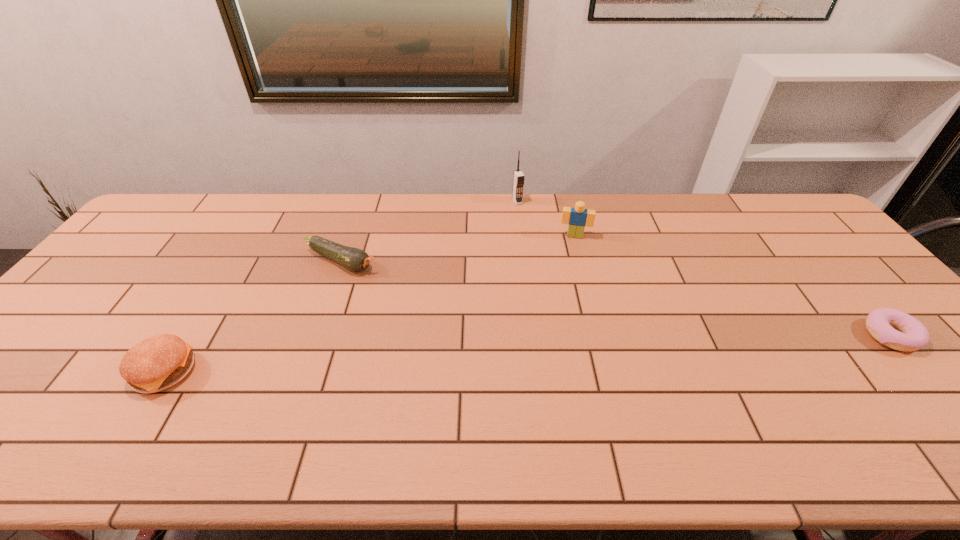
Locate an element on the screen. Image resolution: width=960 pixels, height=540 pixels. vacant space located on the face of the Lego is located at coordinates (565, 318).

This screenshot has width=960, height=540. I want to click on cellular telephone that is at the far edge, so click(x=518, y=177).

The width and height of the screenshot is (960, 540). Find the location of `Lego present at the far edge`. Lego present at the far edge is located at coordinates (579, 217).

Find the location of a particular element. The width and height of the screenshot is (960, 540). object present at the near edge is located at coordinates (159, 362).

Image resolution: width=960 pixels, height=540 pixels. Identify the location of object positioned at the right edge. (912, 335).

The image size is (960, 540). In the image, there is a desktop. What are the coordinates of `vacant region at the far edge` in the screenshot? It's located at (689, 201).

Locate an element on the screen. The height and width of the screenshot is (540, 960). vacant region at the near edge is located at coordinates (64, 411).

This screenshot has height=540, width=960. I want to click on blank space at the left edge of the desktop, so click(121, 260).

You are a GUI agent. You are given a task and a screenshot of the screen. Output one action in this format:
    pyautogui.click(x=<x>, y=<y>)
    Task: Click on the unoccupied area between the cellular telephone and the shortest object
    The image size is (960, 540).
    Given the screenshot: What is the action you would take?
    pyautogui.click(x=704, y=269)

Where is `unoccupied area between the tallest object and the third nearest object`? This screenshot has height=540, width=960. unoccupied area between the tallest object and the third nearest object is located at coordinates (429, 232).